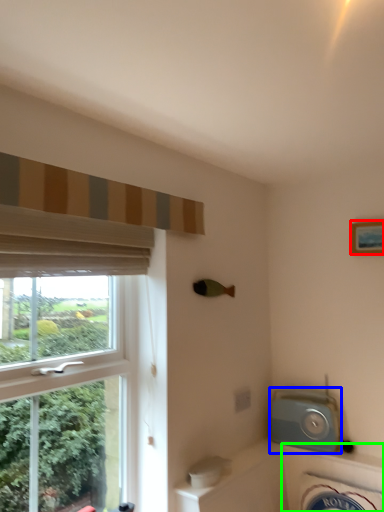
Question: Which is farther away from picture frame (highlighted by a red box)? appliance (highlighted by a blue box) or bath (highlighted by a green box)?

Choices:
 (A) appliance
 (B) bath

Answer: (B)